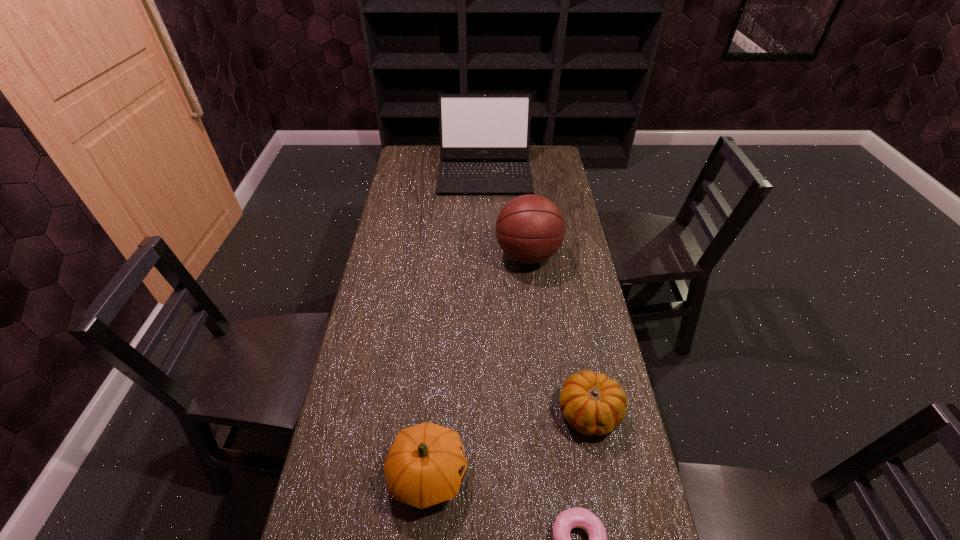
Where is `laptop`? laptop is located at coordinates (484, 138).

Locate an element on the screen. the tallest object is located at coordinates (484, 138).

At what (x,y) coordinates should I click in order to perform the action: click on the fourth shortest object. Please return your answer as a coordinate pair (x, y). The image size is (960, 540). Looking at the image, I should click on (530, 229).

Identify the location of basketball. tap(530, 229).

Where is `the taller gourd`? the taller gourd is located at coordinates (425, 466).

This screenshot has height=540, width=960. I want to click on the third tallest object, so click(x=425, y=466).

Where is `the right gourd`? the right gourd is located at coordinates (593, 404).

Where is `the shorter gourd`? This screenshot has height=540, width=960. the shorter gourd is located at coordinates (593, 404).

In order to click on vacant space situated on the surface of the farthest object in this screenshot , I will do `click(486, 213)`.

The height and width of the screenshot is (540, 960). I want to click on vacant area located on the left of the basketball, so click(468, 255).